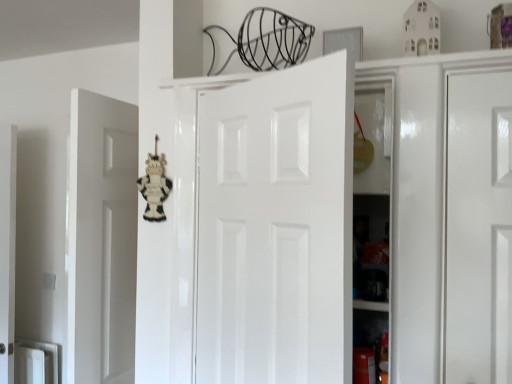
Question: From a real-world perspective, is wooden cow at center physically located above or below white glossy door at center?

Choices:
 (A) below
 (B) above

Answer: (B)

Question: From the image's perspective, is wooden cow at center positioned above or below white glossy door at center?

Choices:
 (A) above
 (B) below

Answer: (A)

Question: Considering the positions of wooden cow at center and white glossy door at center in the image, is wooden cow at center wider or thinner than white glossy door at center?

Choices:
 (A) wide
 (B) thin

Answer: (B)

Question: From the image's perspective, relative to wooden cow at center, is white glossy door at center above or below?

Choices:
 (A) above
 (B) below

Answer: (B)

Question: Is point (224, 122) closer or farther from the camera than point (155, 213)?

Choices:
 (A) closer
 (B) farther

Answer: (A)

Question: From their relative heights in the image, would you say white glossy door at center is taller or shorter than wooden cow at center?

Choices:
 (A) tall
 (B) short

Answer: (A)

Question: Considering the positions of white glossy door at center and wooden cow at center in the image, is white glossy door at center wider or thinner than wooden cow at center?

Choices:
 (A) thin
 (B) wide

Answer: (B)